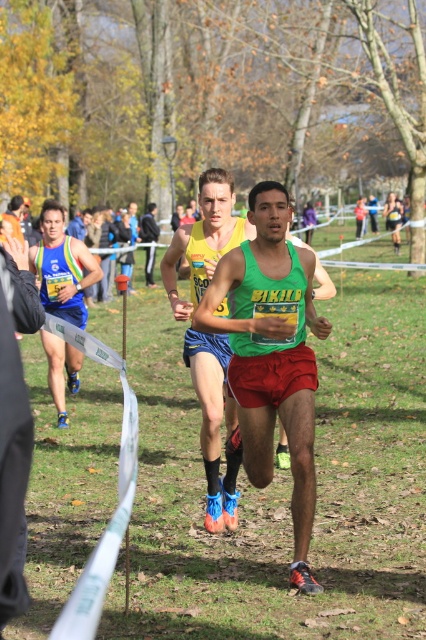
Is point (210, 353) positioned in front of point (97, 275)?

That is True.

Between point (186, 340) and point (36, 268), which one is positioned behind?

Positioned behind is point (36, 268).

This screenshot has width=426, height=640. I want to click on green matte tank top at center, so click(215, 424).